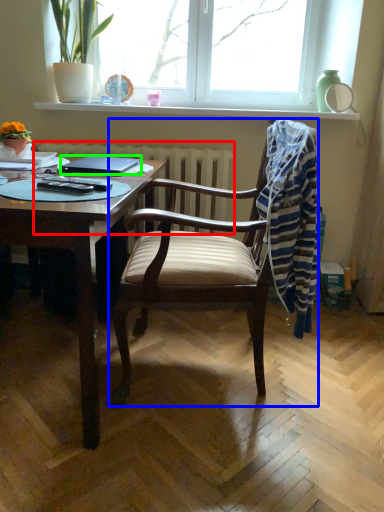
Question: Which object is positioned farthest from radiator (highlighted by a red box)? Select from chair (highlighted by a blue box) and laptop (highlighted by a green box).

Choices:
 (A) chair
 (B) laptop

Answer: (A)